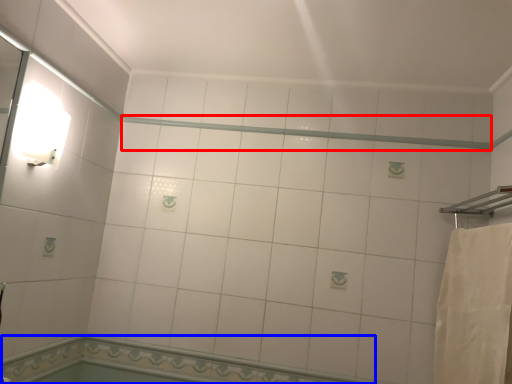
Question: Which object appears farthest to the camera in this image, beam (highlighted by a red box) or bath (highlighted by a blue box)?

Choices:
 (A) beam
 (B) bath

Answer: (A)